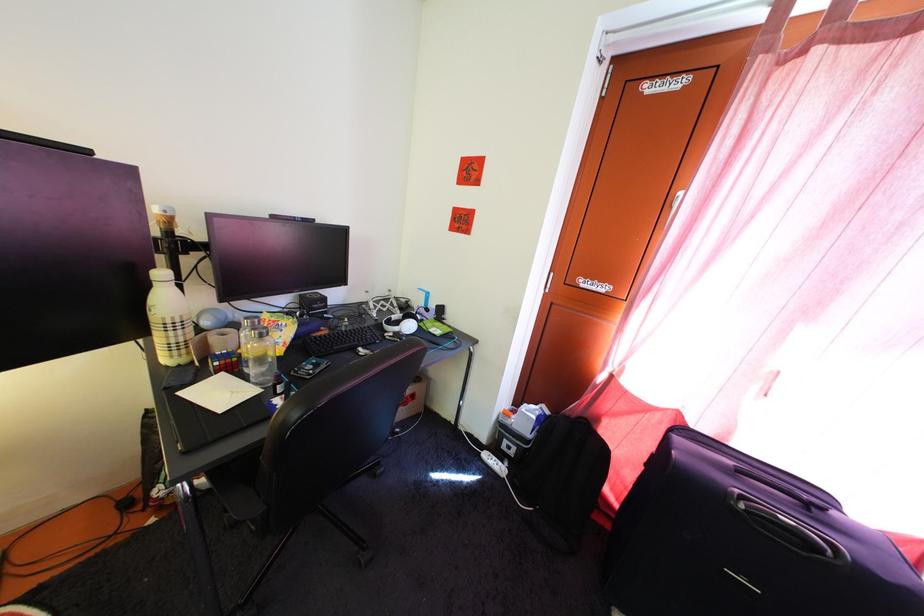
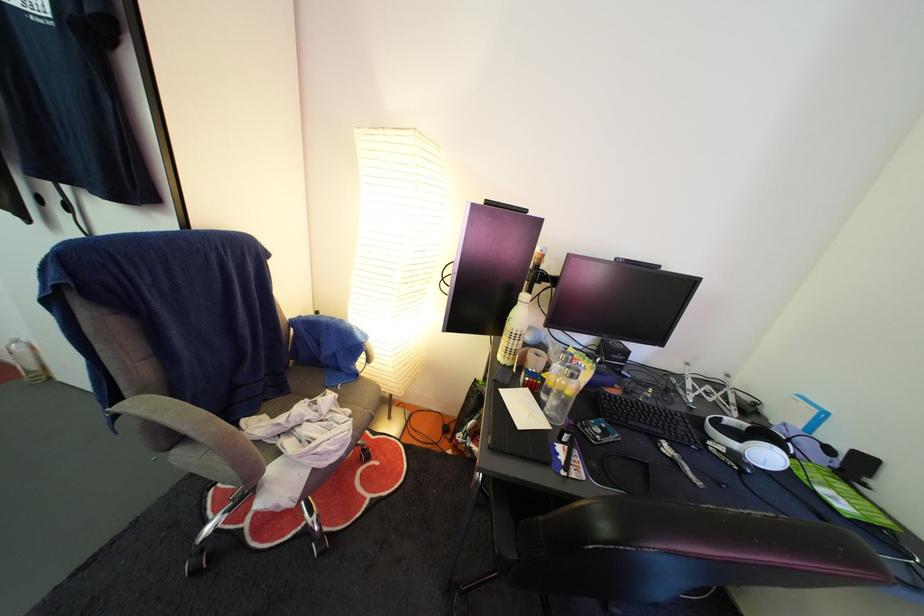
In the second image, find the point that corresponds to point 237,370 in the first image.

(543, 390)